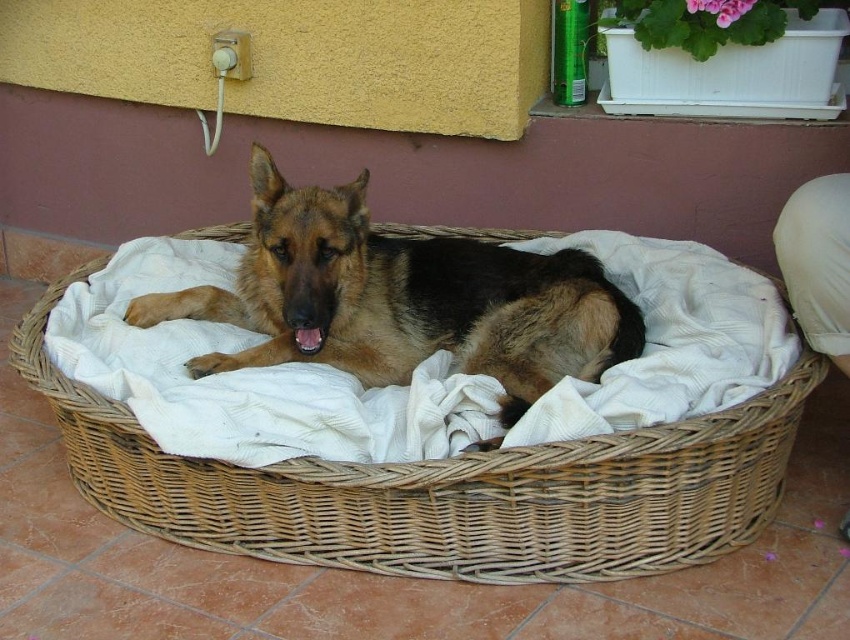
You are a pet owner who wants to place a new toy for your dog. The toy is small enough to fit in the woven wicker basket at center. Where should you place the toy so that the brown fur dog at center can easily reach it?

The woven wicker basket at center is positioned on the right side of the brown fur dog at center, so placing the toy in the basket would allow the dog to easily reach it from its current position.

You are a delivery robot that is 1.5 meters tall. You need to place a package on the woven wicker basket at center. Can you reach the basket without climbing?

The distance of woven wicker basket at center from camera is 1.77 meters. Since the robot is 1.5 meters tall, it cannot reach the basket without climbing.

You are a delivery person who needs to place a small package on the woven wicker basket at center without disturbing the brown fur dog at center. Since the basket is wider than the dog, can you safely place the package on the basket?

The woven wicker basket at center is wider than the brown fur dog at center, so placing the package on the basket should be safe as it has enough space and the dog won not be disturbed.